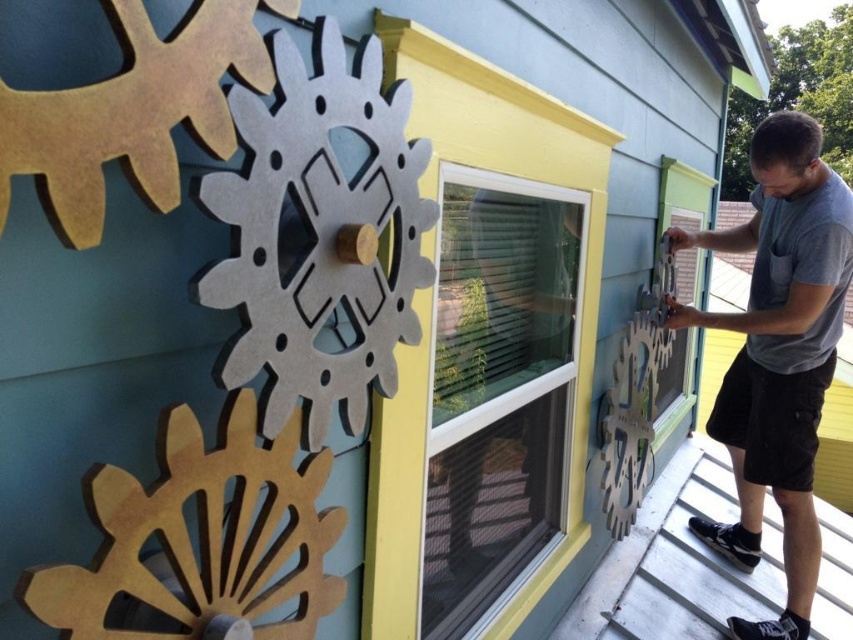
Image resolution: width=853 pixels, height=640 pixels. What do you see at coordinates (498, 388) in the screenshot? I see `yellow plastic window at center` at bounding box center [498, 388].

Does yellow plastic window at center come behind gray cotton shirt at right?

No.

Locate an element on the screen. The image size is (853, 640). yellow plastic window at center is located at coordinates [498, 388].